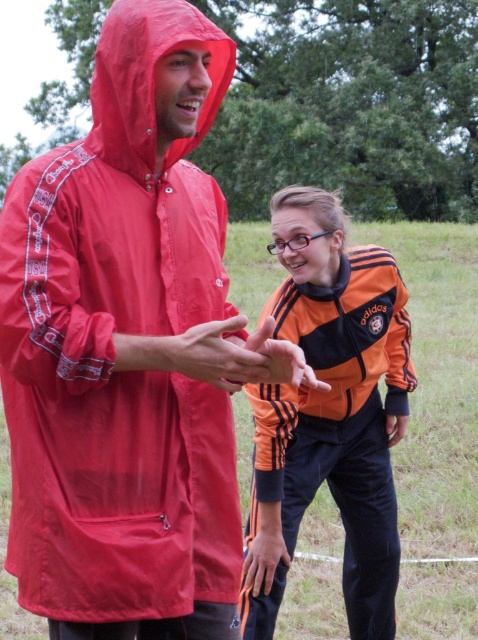
Between matte red raincoat at upper left and matte orange hand at center, which one has less height?

Standing shorter between the two is matte orange hand at center.

Locate an element on the screen. This screenshot has width=478, height=640. matte red raincoat at upper left is located at coordinates (148, 81).

Who is lower down, matte nylon raincoat at center or smooth orange hand at center?

smooth orange hand at center is below.

Does point (203, 54) come in front of point (257, 380)?

No, (203, 54) is behind (257, 380).

The image size is (478, 640). I want to click on matte nylon raincoat at center, so (122, 349).

Is point (14, 298) positioned behind point (122, 8)?

No, it is in front of (122, 8).

Is matte nylon raincoat at center in front of matte red raincoat at upper left?

Yes, it is in front of matte red raincoat at upper left.

What do you see at coordinates (122, 349) in the screenshot? The image size is (478, 640). I see `matte nylon raincoat at center` at bounding box center [122, 349].

This screenshot has height=640, width=478. I want to click on matte nylon raincoat at center, so click(122, 349).